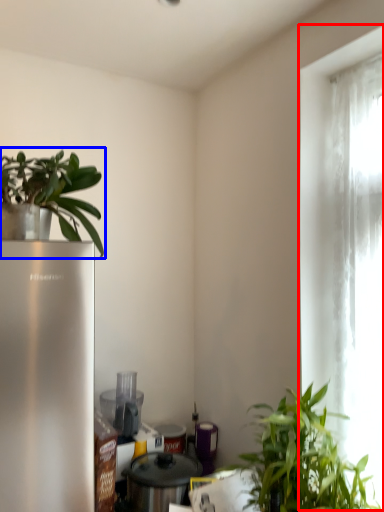
Question: Which object appears farthest to the camera in this image, window (highlighted by a red box) or houseplant (highlighted by a blue box)?

Choices:
 (A) window
 (B) houseplant

Answer: (A)